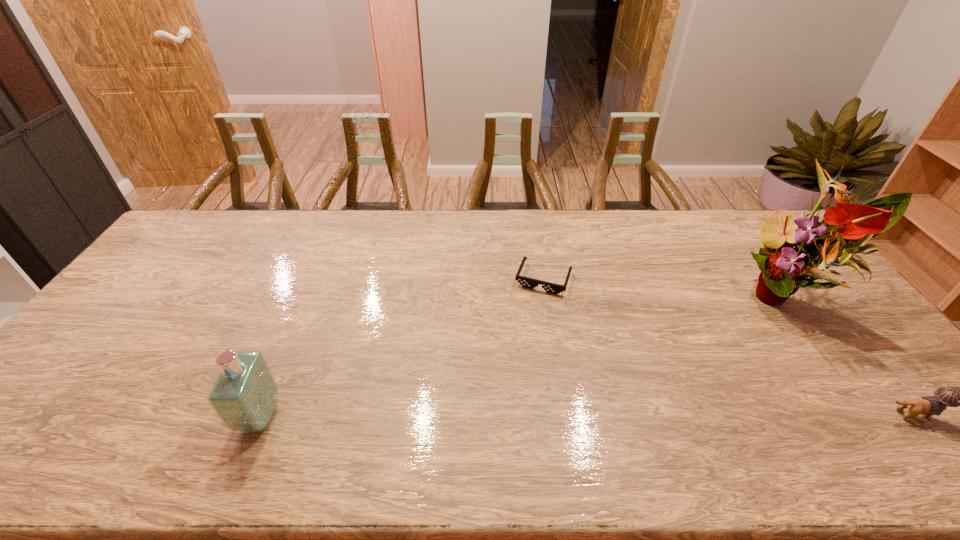
Locate an element on the screen. free region at the right edge of the desktop is located at coordinates (855, 319).

Where is `vacant space that's between the bouquet and the kitten`? This screenshot has width=960, height=540. vacant space that's between the bouquet and the kitten is located at coordinates (852, 356).

Locate an element on the screen. The width and height of the screenshot is (960, 540). free spot between the leftmost object and the shortest object is located at coordinates point(402,348).

Locate an element on the screen. The image size is (960, 540). vacant area between the second object from left to right and the bouquet is located at coordinates (667, 288).

This screenshot has height=540, width=960. Find the location of `free point between the third shortest object and the kitten`. free point between the third shortest object and the kitten is located at coordinates (586, 416).

The height and width of the screenshot is (540, 960). I want to click on empty space between the second object from left to right and the tallest object, so click(x=667, y=288).

Locate an element on the screen. This screenshot has height=540, width=960. free space between the bouquet and the third shortest object is located at coordinates (526, 357).

I want to click on vacant area that lies between the shortest object and the bouquet, so click(667, 288).

Locate an element on the screen. vacant area between the sunglasses and the bouquet is located at coordinates (667, 288).

The width and height of the screenshot is (960, 540). Find the location of `free spot between the shortest object and the bouquet`. free spot between the shortest object and the bouquet is located at coordinates (667, 288).